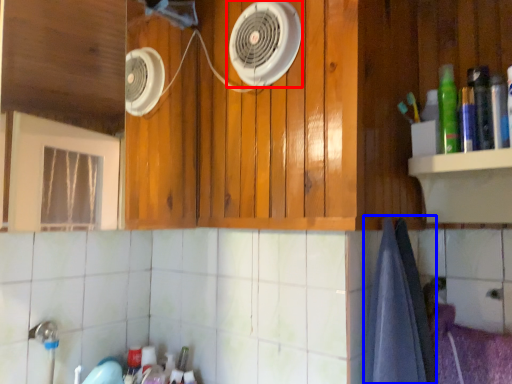
Question: Which point is closer to the camera, home appliance (highlighted by a red box) or bath towel (highlighted by a blue box)?

Choices:
 (A) home appliance
 (B) bath towel

Answer: (B)